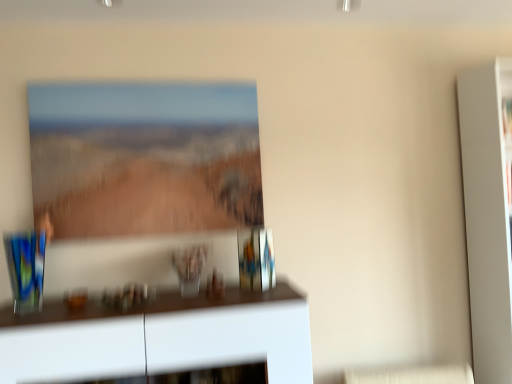
Image resolution: width=512 pixels, height=384 pixels. I want to click on matte glass picture frame at upper center, so click(x=144, y=158).

Where is `translucent glass vase at center`? The height and width of the screenshot is (384, 512). translucent glass vase at center is located at coordinates (189, 268).

Locate an element on the screen. matte glass picture frame at upper center is located at coordinates (144, 158).

Between translucent glass vase at center and matte glass picture frame at upper center, which one has smaller width?

With smaller width is matte glass picture frame at upper center.

Is translucent glass vase at center bigger than matte glass picture frame at upper center?

No.

From a real-world perspective, between translucent glass vase at center and matte glass picture frame at upper center, who is vertically lower?

translucent glass vase at center.

Is translucent glass vase at center situated inside matte glass picture frame at upper center or outside?

translucent glass vase at center exists outside the volume of matte glass picture frame at upper center.

From a real-world perspective, is white glossy cabinet at lower center beneath matte glass picture frame at upper center?

Indeed, from a real-world perspective, white glossy cabinet at lower center is positioned beneath matte glass picture frame at upper center.

Looking at this image, is white glossy cabinet at lower center wider or thinner than matte glass picture frame at upper center?

Clearly, white glossy cabinet at lower center has more width compared to matte glass picture frame at upper center.

Looking at this image, which point is more forward, (168,329) or (34,214)?

Positioned in front is point (168,329).

Where is `glass vase on the right of white glossy cabinet at lower center`? Image resolution: width=512 pixels, height=384 pixels. glass vase on the right of white glossy cabinet at lower center is located at coordinates (189, 268).

Which point is more forward, (x=202, y=257) or (x=50, y=359)?

Positioned in front is point (x=50, y=359).

Does translucent glass vase at center touch white glossy cabinet at lower center?

No, translucent glass vase at center is not touching white glossy cabinet at lower center.

How distant is white glossy cabinet at lower center from translucent glass vase at center?

The distance of white glossy cabinet at lower center from translucent glass vase at center is 30.92 centimeters.

Between white glossy cabinet at lower center and translucent glass vase at center, which one has more height?

white glossy cabinet at lower center is taller.

Where is `furniture on the left of translucent glass vase at center`? This screenshot has height=384, width=512. furniture on the left of translucent glass vase at center is located at coordinates (160, 337).

Looking at this image, from the image's perspective, which object appears higher, white glossy cabinet at lower center or translucent glass vase at center?

translucent glass vase at center is shown above in the image.

From a real-world perspective, between matte glass picture frame at upper center and white glossy cabinet at lower center, who is vertically lower?

From a 3D spatial view, white glossy cabinet at lower center is below.

Is matte glass picture frame at upper center facing towards white glossy cabinet at lower center?

No, matte glass picture frame at upper center does not turn towards white glossy cabinet at lower center.

Consider the image. Considering the relative sizes of matte glass picture frame at upper center and white glossy cabinet at lower center in the image provided, is matte glass picture frame at upper center smaller than white glossy cabinet at lower center?

Correct, matte glass picture frame at upper center occupies less space than white glossy cabinet at lower center.

Relative to white glossy cabinet at lower center, is matte glass picture frame at upper center in front or behind?

Visually, matte glass picture frame at upper center is located behind white glossy cabinet at lower center.

From the image's perspective, is matte glass picture frame at upper center located beneath translucent glass vase at center?

No, from the image's perspective, matte glass picture frame at upper center is not below translucent glass vase at center.

Would you say matte glass picture frame at upper center is outside translucent glass vase at center?

That's correct, matte glass picture frame at upper center is outside of translucent glass vase at center.

Does matte glass picture frame at upper center have a lesser width compared to translucent glass vase at center?

Yes.

From the picture: Is matte glass picture frame at upper center at the right side of translucent glass vase at center?

No, matte glass picture frame at upper center is not to the right of translucent glass vase at center.

Locate an element on the screen. glass vase below the matte glass picture frame at upper center (from a real-world perspective) is located at coordinates (189, 268).

In order to click on furniture below the matte glass picture frame at upper center (from the image's perspective) in this screenshot , I will do `click(160, 337)`.

When comparing their distances from matte glass picture frame at upper center, does translucent glass vase at center or white glossy cabinet at lower center seem further?

white glossy cabinet at lower center is positioned further to the anchor matte glass picture frame at upper center.

From the image, which object appears to be nearer to white glossy cabinet at lower center, translucent glass vase at center or matte glass picture frame at upper center?

translucent glass vase at center is closer to white glossy cabinet at lower center.

Which object lies further to the anchor point translucent glass vase at center, matte glass picture frame at upper center or white glossy cabinet at lower center?

The object further to translucent glass vase at center is matte glass picture frame at upper center.

Based on their spatial positions, is white glossy cabinet at lower center or translucent glass vase at center closer to matte glass picture frame at upper center?

Among the two, translucent glass vase at center is located nearer to matte glass picture frame at upper center.

Which object lies further to the anchor point white glossy cabinet at lower center, matte glass picture frame at upper center or translucent glass vase at center?

matte glass picture frame at upper center.

Estimate the real-world distances between objects in this image. Which object is closer to translucent glass vase at center, white glossy cabinet at lower center or matte glass picture frame at upper center?

Based on the image, white glossy cabinet at lower center appears to be nearer to translucent glass vase at center.

At what (x,y) coordinates should I click in order to perform the action: click on glass vase between matte glass picture frame at upper center and white glossy cabinet at lower center from top to bottom. Please return your answer as a coordinate pair (x, y). This screenshot has height=384, width=512. Looking at the image, I should click on (189, 268).